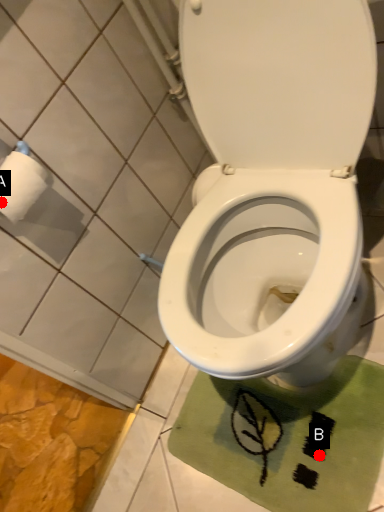
Question: Two points are circled on the image, labeled by A and B beside each circle. Which point is farther to the camera?

Choices:
 (A) A is further
 (B) B is further

Answer: (B)